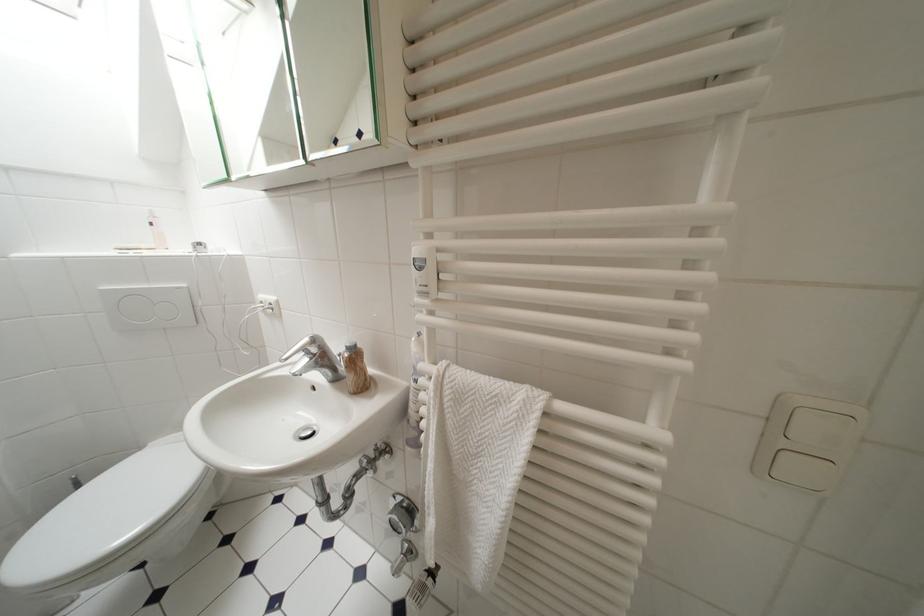
What do you see at coordinates (111, 522) in the screenshot? I see `the white toilet lid` at bounding box center [111, 522].